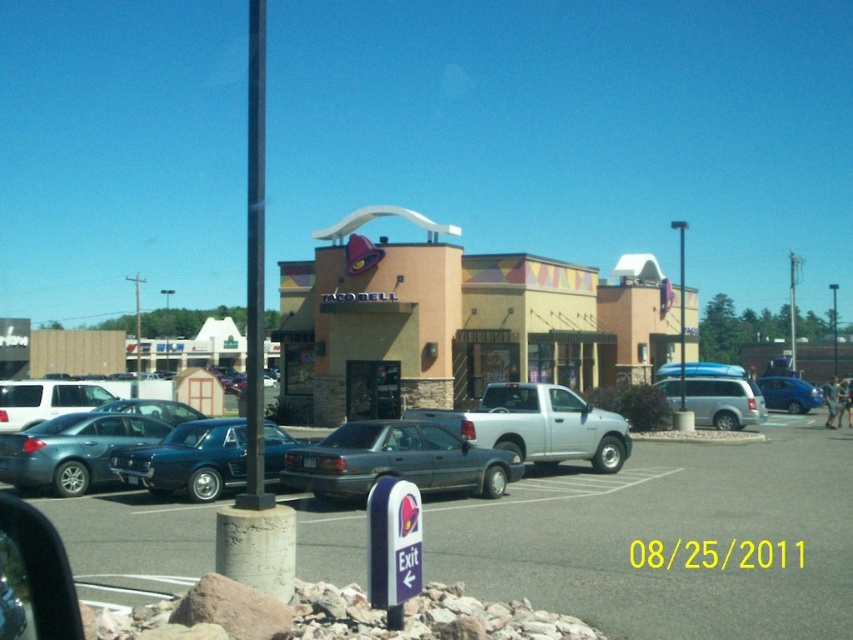
You are standing at the entrance of the Taco Bell restaurant and want to walk to the point marked at coordinates point (328, 483). How far will you have to walk?

The point (328, 483) is 15.05 meters away from the viewer, so you will have to walk 15.05 meters to reach it.

You are a customer arriving at the Taco Bell restaurant and need to park your car. You see a gray matte sedan at center and a silver metallic van at center. Which vehicle should you park to the right of to align with the parking lines?

You should park to the right of the gray matte sedan at center because it is positioned to the left of the silver metallic van at center, so placing your vehicle there would maintain alignment with the parking lines.

You are a customer arriving at the Taco Bell restaurant and see both the shiny blue car at center and the metallic blue sedan at center in the parking lot. Which vehicle is closer to the entrance of the restaurant?

The shiny blue car at center is closer to the entrance of the restaurant because it is in front of the metallic blue sedan at center, which is further away.